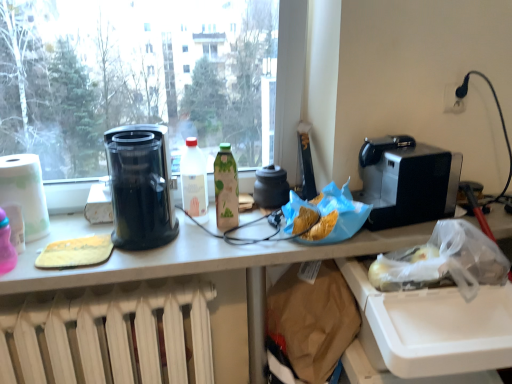
Find the location of `transparent plastic coffee maker at left`. transparent plastic coffee maker at left is located at coordinates (140, 186).

From the picture: In order to face transparent glass window at upper left, should I rotate leftwards or rightwards?

A 12.789 degree turn to the left will do.

The width and height of the screenshot is (512, 384). I want to click on green matte bottle at center, marked as the second bottle in a left-to-right arrangement, so click(226, 188).

Where is `golden crispy chips at center, which is counted as the second food, starting from the left`? The image size is (512, 384). golden crispy chips at center, which is counted as the second food, starting from the left is located at coordinates coord(325,215).

Find the location of a particular element. The width and height of the screenshot is (512, 384). white paper towel at left is located at coordinates (25, 192).

From the picture: Considering the sizes of objects yellow sponge at left, which is the 2th food from right to left, and white radiator at lower center in the image provided, who is smaller, yellow sponge at left, which is the 2th food from right to left, or white radiator at lower center?

yellow sponge at left, which is the 2th food from right to left.

From the image's perspective, would you say yellow sponge at left, marked as the 1th food in a left-to-right arrangement, is positioned over white radiator at lower center?

Yes.

Who is taller, yellow sponge at left, which is the 2th food from right to left, or white radiator at lower center?

With more height is white radiator at lower center.

Is yellow sponge at left, marked as the 1th food in a left-to-right arrangement, with white radiator at lower center?

yellow sponge at left, marked as the 1th food in a left-to-right arrangement, is not next to white radiator at lower center, and they're not touching.

Is green matte bottle at center, the 1th bottle viewed from the right, turned away from transparent glass window at upper left?

Yes.

Considering the relative positions of green matte bottle at center, the 1th bottle viewed from the right, and transparent glass window at upper left in the image provided, is green matte bottle at center, the 1th bottle viewed from the right, behind transparent glass window at upper left?

Yes, green matte bottle at center, the 1th bottle viewed from the right, is further from the viewer.

From the image's perspective, which is above, green matte bottle at center, marked as the second bottle in a left-to-right arrangement, or transparent glass window at upper left?

transparent glass window at upper left is shown above in the image.

Can you confirm if green matte bottle at center, marked as the second bottle in a left-to-right arrangement, is positioned to the left of transparent glass window at upper left?

No.

Are golden crispy chips at center, which is the 1th food in right-to-left order, and green matte bottle at center, the 1th bottle viewed from the right, making contact?

golden crispy chips at center, which is the 1th food in right-to-left order, is not next to green matte bottle at center, the 1th bottle viewed from the right, and they're not touching.

Is green matte bottle at center, marked as the second bottle in a left-to-right arrangement, completely or partially inside golden crispy chips at center, which is the 1th food in right-to-left order?

No, green matte bottle at center, marked as the second bottle in a left-to-right arrangement, is not surrounded by golden crispy chips at center, which is the 1th food in right-to-left order.

In the scene shown: From the image's perspective, which is below, golden crispy chips at center, which is the 1th food in right-to-left order, or green matte bottle at center, marked as the second bottle in a left-to-right arrangement?

From the image's view, golden crispy chips at center, which is the 1th food in right-to-left order, is below.

Does point (290, 207) appear closer or farther from the camera than point (234, 172)?

Point (290, 207) is closer to the camera than point (234, 172).

What's the angular difference between golden crispy chips at center, which is the 1th food in right-to-left order, and white glossy bottle at center, the 1th bottle when ordered from left to right,'s facing directions?

The angle between the facing direction of golden crispy chips at center, which is the 1th food in right-to-left order, and the facing direction of white glossy bottle at center, the 1th bottle when ordered from left to right, is 0.558 degrees.

From a real-world perspective, which is physically above, golden crispy chips at center, which is the 1th food in right-to-left order, or white glossy bottle at center, the 1th bottle when ordered from left to right?

white glossy bottle at center, the 1th bottle when ordered from left to right, is physically above.

Considering the sizes of objects golden crispy chips at center, which is the 1th food in right-to-left order, and white glossy bottle at center, the second bottle when ordered from right to left, in the image provided, who is smaller, golden crispy chips at center, which is the 1th food in right-to-left order, or white glossy bottle at center, the second bottle when ordered from right to left,?

white glossy bottle at center, the second bottle when ordered from right to left.

Is transparent glass window at upper left facing towards white glossy bottle at center, the second bottle when ordered from right to left?

Yes, transparent glass window at upper left is turned towards white glossy bottle at center, the second bottle when ordered from right to left.

What's the angular difference between transparent glass window at upper left and white glossy bottle at center, the 1th bottle when ordered from left to right,'s facing directions?

transparent glass window at upper left and white glossy bottle at center, the 1th bottle when ordered from left to right, are facing 1.54 degrees away from each other.

Between transparent glass window at upper left and white glossy bottle at center, the second bottle when ordered from right to left, which one has larger width?

Wider between the two is transparent glass window at upper left.

From a real-world perspective, does transparent glass window at upper left stand above transparent plastic coffee maker at left?

Yes, from a real-world perspective, transparent glass window at upper left is above transparent plastic coffee maker at left.

Looking at this image, from the image's perspective, is transparent glass window at upper left under transparent plastic coffee maker at left?

No, from the image's perspective, transparent glass window at upper left is not beneath transparent plastic coffee maker at left.

In the scene shown: Does transparent glass window at upper left appear on the left side of transparent plastic coffee maker at left?

In fact, transparent glass window at upper left is to the right of transparent plastic coffee maker at left.

Is transparent glass window at upper left closer to camera compared to transparent plastic coffee maker at left?

Yes, transparent glass window at upper left is closer to the viewer.

Measure the distance between yellow sponge at left, which is the 2th food from right to left, and matte black pot at center.

yellow sponge at left, which is the 2th food from right to left, is 21.85 inches away from matte black pot at center.

Does yellow sponge at left, marked as the 1th food in a left-to-right arrangement, have a greater width compared to matte black pot at center?

Yes, yellow sponge at left, marked as the 1th food in a left-to-right arrangement, is wider than matte black pot at center.

Is the surface of yellow sponge at left, which is the 2th food from right to left, in direct contact with matte black pot at center?

There is a gap between yellow sponge at left, which is the 2th food from right to left, and matte black pot at center.

Would you say yellow sponge at left, marked as the 1th food in a left-to-right arrangement, is inside or outside matte black pot at center?

The correct answer is: outside.

Locate an element on the screen. heater located underneath the yellow sponge at left, marked as the 1th food in a left-to-right arrangement (from a real-world perspective) is located at coordinates (108, 333).

Identify the location of window in front of the green matte bottle at center, the 1th bottle viewed from the right. The height and width of the screenshot is (384, 512). (150, 78).

Estimate the real-world distances between objects in this image. Which object is further from satin black coffee machine at right, yellow sponge at left, marked as the 1th food in a left-to-right arrangement, or matte black pot at center?

yellow sponge at left, marked as the 1th food in a left-to-right arrangement, is positioned further to the anchor satin black coffee machine at right.

From the picture: Looking at the image, which one is located closer to transparent glass window at upper left, yellow sponge at left, which is the 2th food from right to left, or satin black coffee machine at right?

The object closer to transparent glass window at upper left is satin black coffee machine at right.

Considering their positions, is golden crispy chips at center, which is the 1th food in right-to-left order, positioned closer to yellow sponge at left, which is the 2th food from right to left, than white glossy bottle at center, the 1th bottle when ordered from left to right?

white glossy bottle at center, the 1th bottle when ordered from left to right, is closer to yellow sponge at left, which is the 2th food from right to left.

Looking at the image, which one is located closer to white paper towel at left, white radiator at lower center or matte black pot at center?

Based on the image, white radiator at lower center appears to be nearer to white paper towel at left.

Considering their positions, is golden crispy chips at center, which is the 1th food in right-to-left order, positioned closer to white radiator at lower center than green matte bottle at center, the 1th bottle viewed from the right?

green matte bottle at center, the 1th bottle viewed from the right, is closer to white radiator at lower center.

When comparing their distances from white radiator at lower center, does white glossy bottle at center, the 1th bottle when ordered from left to right, or transparent glass window at upper left seem closer?

The object closer to white radiator at lower center is white glossy bottle at center, the 1th bottle when ordered from left to right.

Estimate the real-world distances between objects in this image. Which object is closer to white glossy bottle at center, the 1th bottle when ordered from left to right, white radiator at lower center or golden crispy chips at center, which is counted as the second food, starting from the left?

golden crispy chips at center, which is counted as the second food, starting from the left, is closer to white glossy bottle at center, the 1th bottle when ordered from left to right.

Looking at the image, which one is located closer to transparent glass window at upper left, white glossy bottle at center, the second bottle when ordered from right to left, or yellow sponge at left, which is the 2th food from right to left?

white glossy bottle at center, the second bottle when ordered from right to left, is positioned closer to the anchor transparent glass window at upper left.

At what (x,y) coordinates should I click in order to perform the action: click on toilet paper between white glossy bottle at center, the second bottle when ordered from right to left, and white radiator at lower center in the up-down direction. Please return your answer as a coordinate pair (x, y). The width and height of the screenshot is (512, 384). Looking at the image, I should click on (25, 192).

The image size is (512, 384). Find the location of `bottle between transparent plastic coffee maker at left and green matte bottle at center, the 1th bottle viewed from the right`. bottle between transparent plastic coffee maker at left and green matte bottle at center, the 1th bottle viewed from the right is located at coordinates (194, 180).

Image resolution: width=512 pixels, height=384 pixels. In order to click on appliance between white glossy bottle at center, the 1th bottle when ordered from left to right, and golden crispy chips at center, which is counted as the second food, starting from the left, from left to right in this screenshot , I will do coord(271,187).

You are a GUI agent. You are given a task and a screenshot of the screen. Output one action in this format:
    pyautogui.click(x=<x>, y=<y>)
    Task: Click on the appliance between yellow sponge at left, marked as the 1th food in a left-to-right arrangement, and satin black coffee machine at right
    This screenshot has height=384, width=512.
    Given the screenshot: What is the action you would take?
    pyautogui.click(x=271, y=187)